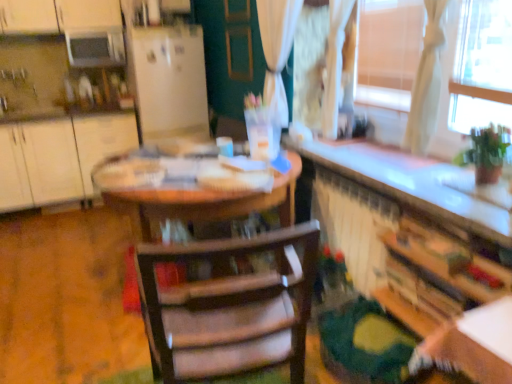
Question: Is wooden bookshelf at lower right, which is the 1th cabinetry from bottom to top, shorter than white matte refrigerator at center?

Choices:
 (A) no
 (B) yes

Answer: (B)

Question: From the image's perspective, is wooden bookshelf at lower right, which appears as the 2th cabinetry when viewed from the back, under white matte refrigerator at center?

Choices:
 (A) no
 (B) yes

Answer: (B)

Question: From a real-world perspective, is wooden bookshelf at lower right, the first cabinetry viewed from the front, on white matte refrigerator at center?

Choices:
 (A) yes
 (B) no

Answer: (B)

Question: Does wooden bookshelf at lower right, which appears as the 2th cabinetry when viewed from the back, have a smaller size compared to white matte refrigerator at center?

Choices:
 (A) no
 (B) yes

Answer: (B)

Question: Is wooden bookshelf at lower right, placed as the 1th cabinetry when sorted from right to left, not inside white matte refrigerator at center?

Choices:
 (A) no
 (B) yes

Answer: (B)

Question: Is wooden bookshelf at lower right, placed as the 2th cabinetry when sorted from left to right, facing towards white matte refrigerator at center?

Choices:
 (A) no
 (B) yes

Answer: (A)

Question: Does white matte refrigerator at center have a larger size compared to wooden chair at center?

Choices:
 (A) no
 (B) yes

Answer: (B)

Question: From a real-world perspective, is white matte refrigerator at center physically above wooden chair at center?

Choices:
 (A) yes
 (B) no

Answer: (A)

Question: Is white matte refrigerator at center to the left of wooden chair at center from the viewer's perspective?

Choices:
 (A) no
 (B) yes

Answer: (B)

Question: Does white matte refrigerator at center come in front of wooden chair at center?

Choices:
 (A) no
 (B) yes

Answer: (A)

Question: From the image's perspective, does white matte refrigerator at center appear lower than wooden chair at center?

Choices:
 (A) no
 (B) yes

Answer: (A)

Question: Does white matte refrigerator at center have a lesser height compared to wooden chair at center?

Choices:
 (A) no
 (B) yes

Answer: (A)

Question: Is white matte cabinet at left, the 2th cabinetry from the front, wider than matte brown screen door at center?

Choices:
 (A) no
 (B) yes

Answer: (B)